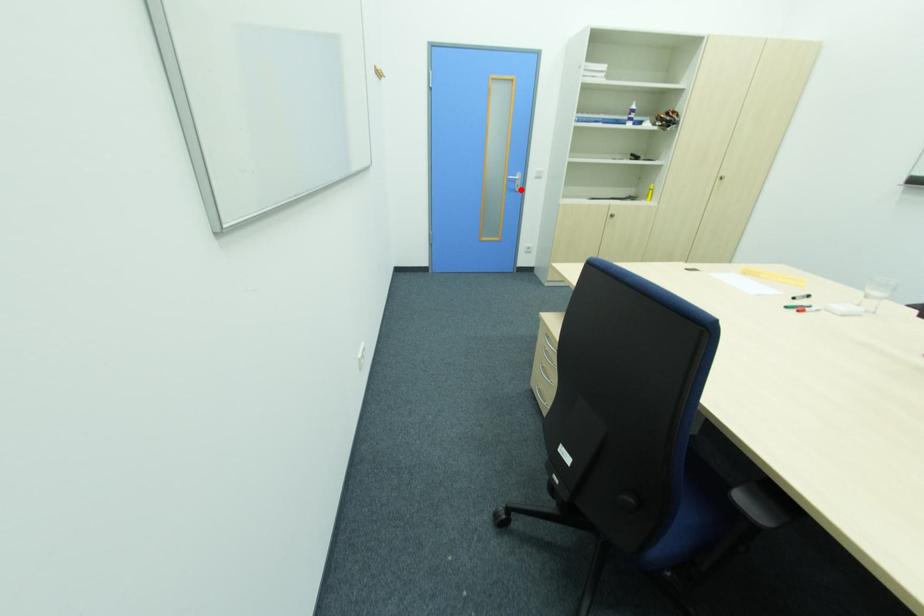
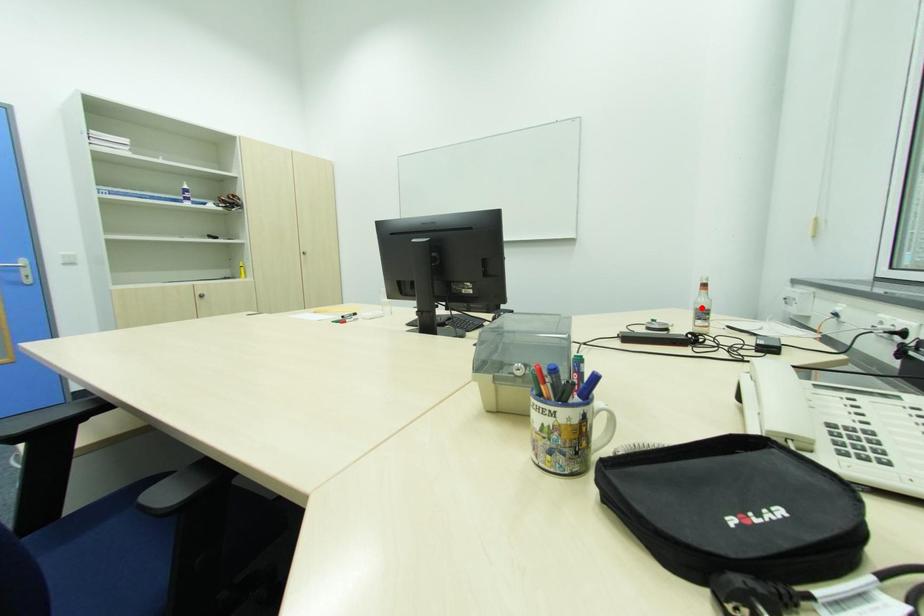
I am providing you with two images of the same scene from different viewpoints. A red point is marked on the first image and another point is marked on the second image. Do the highlighted points in image1 and image2 indicate the same real-world spot?

No